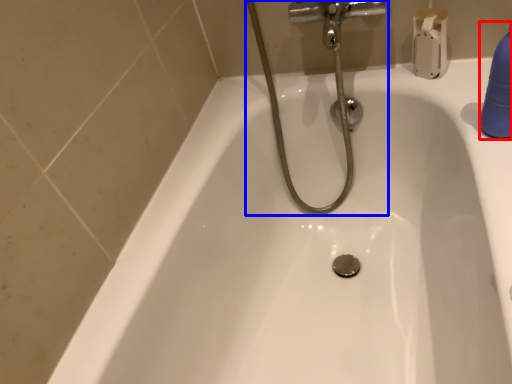
Question: Which object is closer to the camera taking this photo, cleaning product (highlighted by a red box) or plumbing fixture (highlighted by a blue box)?

Choices:
 (A) cleaning product
 (B) plumbing fixture

Answer: (A)